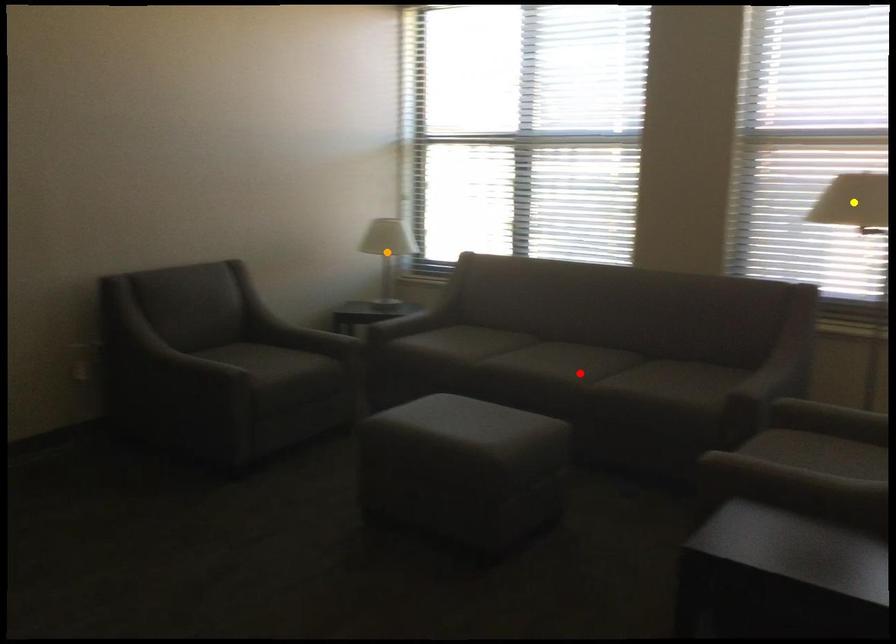
Order these from nearest to farthest:
orange point | red point | yellow point

yellow point → red point → orange point